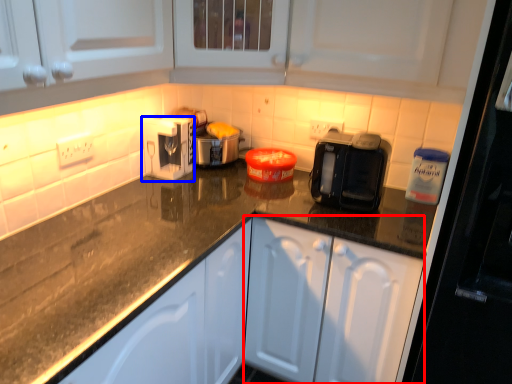
Question: Which of the following is the farthest to the observer, cabinetry (highlighted by a red box) or kitchen appliance (highlighted by a blue box)?

Choices:
 (A) cabinetry
 (B) kitchen appliance

Answer: (B)